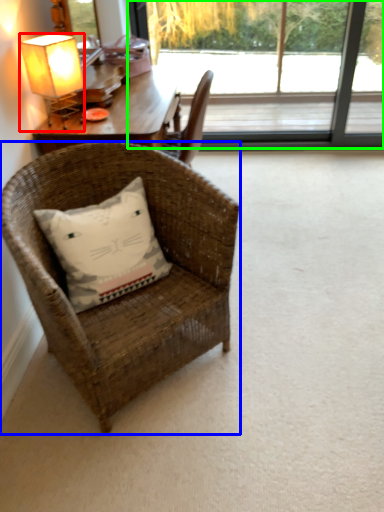
Question: Which is nearer to the lamp (highlighted by a red box)? chair (highlighted by a blue box) or window (highlighted by a green box).

Choices:
 (A) chair
 (B) window

Answer: (A)